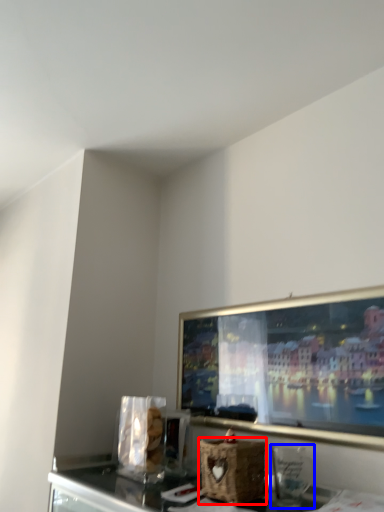
Question: Which of the following is the farthest to the observer, basket (highlighted by a red box) or appliance (highlighted by a blue box)?

Choices:
 (A) basket
 (B) appliance

Answer: (A)